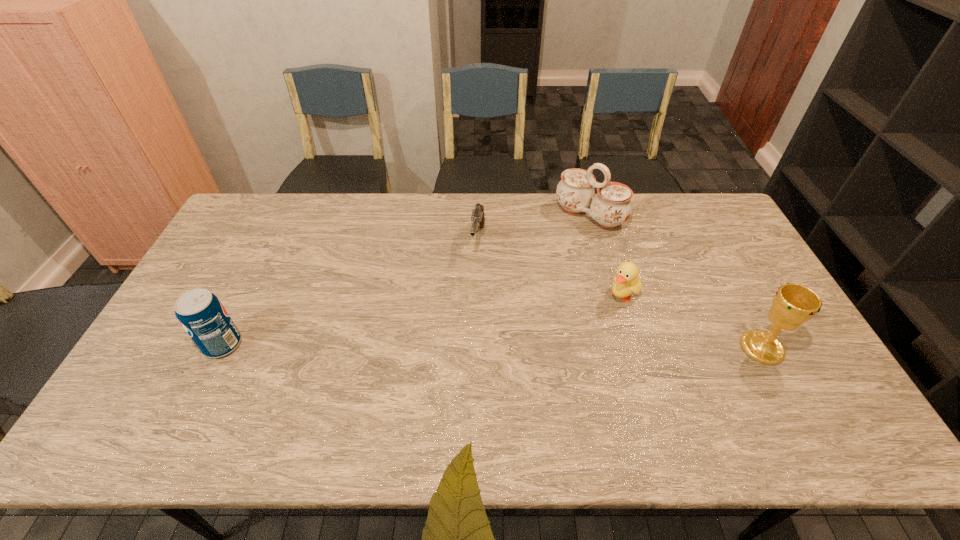
Where is `free spot on the desktop that is between the leftmost object and the chalice and is positioned on the front-facing side of the third farthest object`? This screenshot has height=540, width=960. free spot on the desktop that is between the leftmost object and the chalice and is positioned on the front-facing side of the third farthest object is located at coordinates (570, 347).

This screenshot has width=960, height=540. I want to click on vacant space on the desktop that is between the third shortest object and the chalice and is positioned by the handle of the chinaware, so click(x=465, y=346).

The height and width of the screenshot is (540, 960). In order to click on vacant space on the desktop that is between the third tallest object and the rightmost object and is positioned at the barrel of the second object from left to right in this screenshot , I will do `click(458, 346)`.